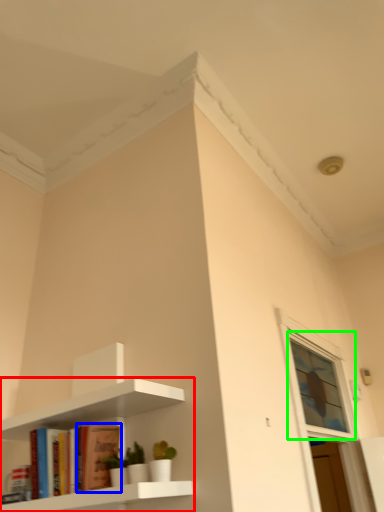
Question: Which object is positioned closest to shelf (highlighted by a red box)? Select from book (highlighted by a blue box) and window (highlighted by a green box).

Choices:
 (A) book
 (B) window

Answer: (A)